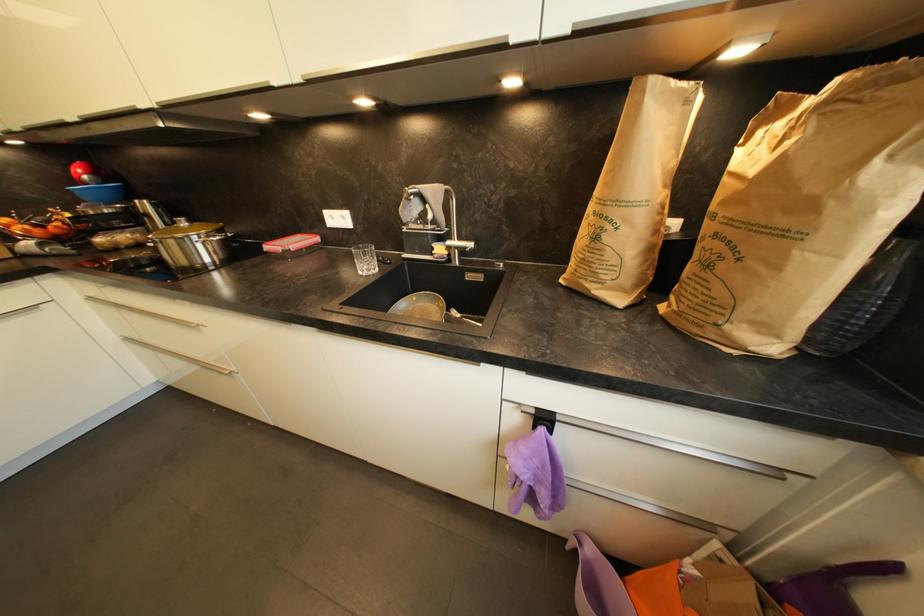
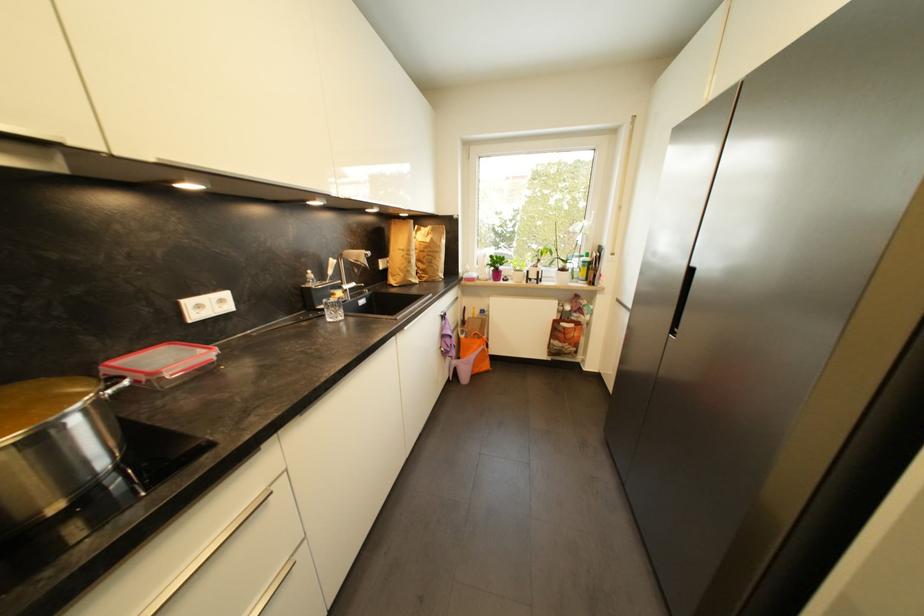
Find the pixel in the second image that matches pixel 711 529 in the first image.

(463, 328)